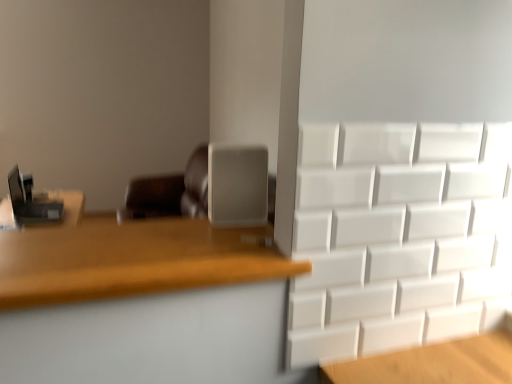
Describe the element at coordinates (237, 186) in the screenshot. Image resolution: width=512 pixels, height=384 pixels. I see `matte gray speaker at center` at that location.

Image resolution: width=512 pixels, height=384 pixels. Identify the location of matte gray speaker at center. (237, 186).

Where is `matte gray speaker at center`? matte gray speaker at center is located at coordinates (237, 186).